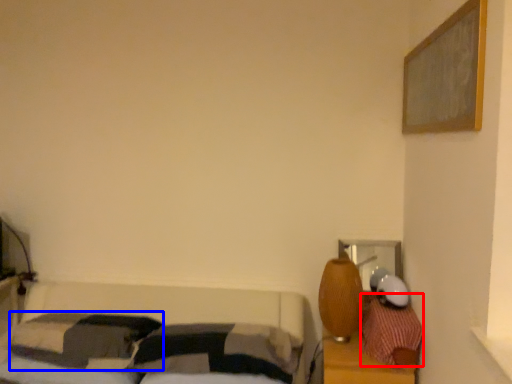
Question: Which object appears farthest to the camera in this image, pillow (highlighted by a red box) or pillow (highlighted by a blue box)?

Choices:
 (A) pillow
 (B) pillow

Answer: (B)